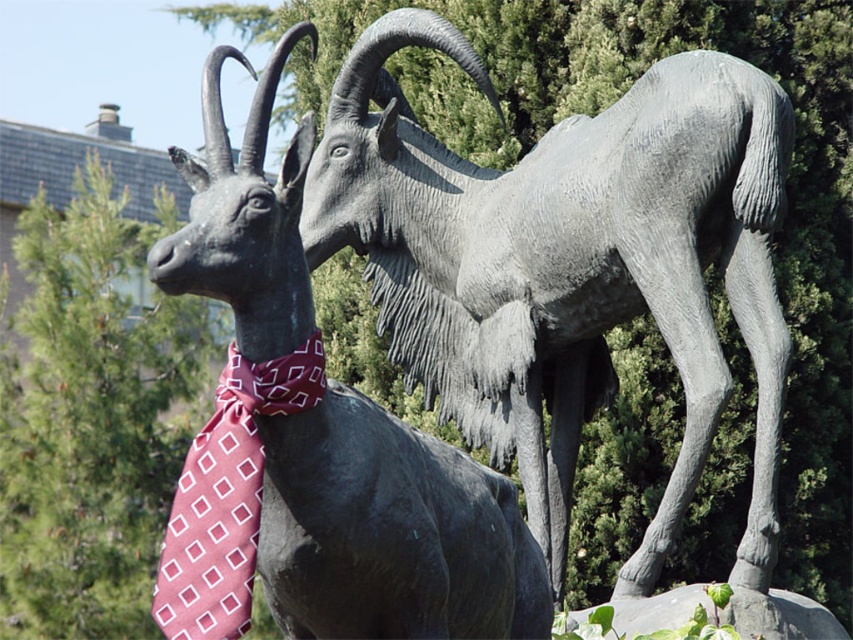
You are an art curator planning to move the matte gray goat at center and the maroon silk tie at center to a new exhibition space. The entrance door has a width of 0.5 meters. Can both items pass through the door without being damaged if carried side by side?

The matte gray goat at center is thinner than the maroon silk tie at center. Since the door is 0.5 meters wide, and the maroon silk tie at center is wider, the total combined width of both items would exceed the door width. Therefore, they cannot pass through the door side by side without being damaged.

You are an art curator planning to move the matte gray goat at center and the maroon silk tie at center to a new exhibition space. The entrance door has a height restriction of 1.5 meters. Given their sizes, will both items fit through the door without any adjustments?

The matte gray goat at center has a smaller size compared to maroon silk tie at center. However, the height restriction of the door is 1.5 meters. Since the description only mentions the relative size between the two objects and not their absolute dimensions, it is impossible to determine if they will fit through the door based on the provided information.

You are an art curator planning to display the matte gray goat at center and the matte black goat at center in a gallery. Given their heights, which goat should be placed on the lower shelf to ensure proper visibility of both sculptures?

The matte black goat at center should be placed on the lower shelf because it is shorter than the matte gray goat at center, allowing both to be visible without obstruction.